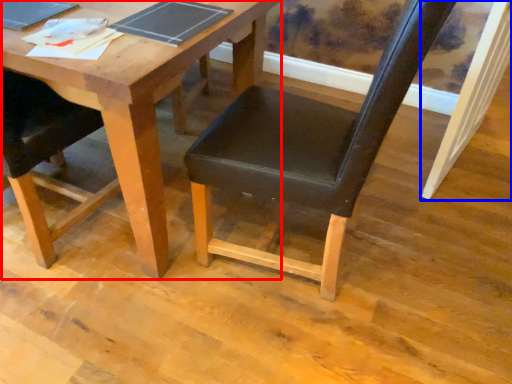
Question: Which object is further to the camera taking this photo, table (highlighted by a red box) or plank (highlighted by a blue box)?

Choices:
 (A) table
 (B) plank

Answer: (B)